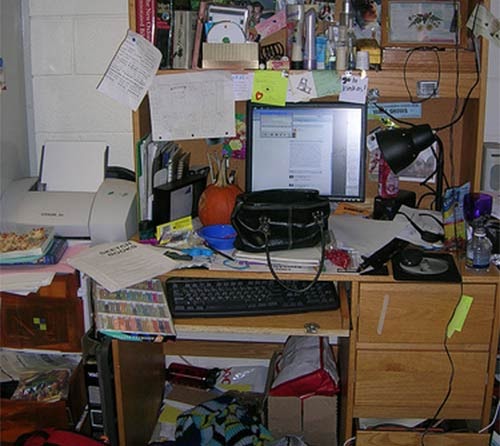
Identify the location of lamp. (422, 144).